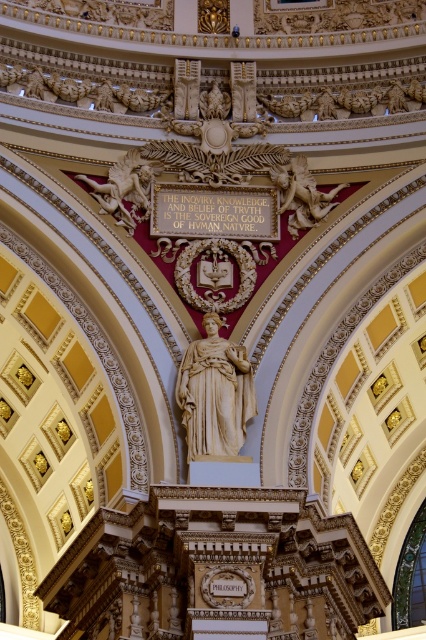
Question: Does white marble statue at center come in front of matte gold cherub at upper center?

Choices:
 (A) no
 (B) yes

Answer: (B)

Question: Does white marble winged horse at upper left appear on the right side of matte gold cherub at upper center?

Choices:
 (A) yes
 (B) no

Answer: (B)

Question: Which point appears farthest from the camera in this image?

Choices:
 (A) (141, 160)
 (B) (288, 202)

Answer: (A)

Question: Which is nearer to the white marble winged horse at upper left?

Choices:
 (A) white marble statue at center
 (B) matte gold cherub at upper center

Answer: (B)

Question: Does white marble statue at center appear under white marble winged horse at upper left?

Choices:
 (A) yes
 (B) no

Answer: (A)

Question: Considering the real-world distances, which object is closest to the matte gold cherub at upper center?

Choices:
 (A) white marble statue at center
 (B) white marble winged horse at upper left

Answer: (B)